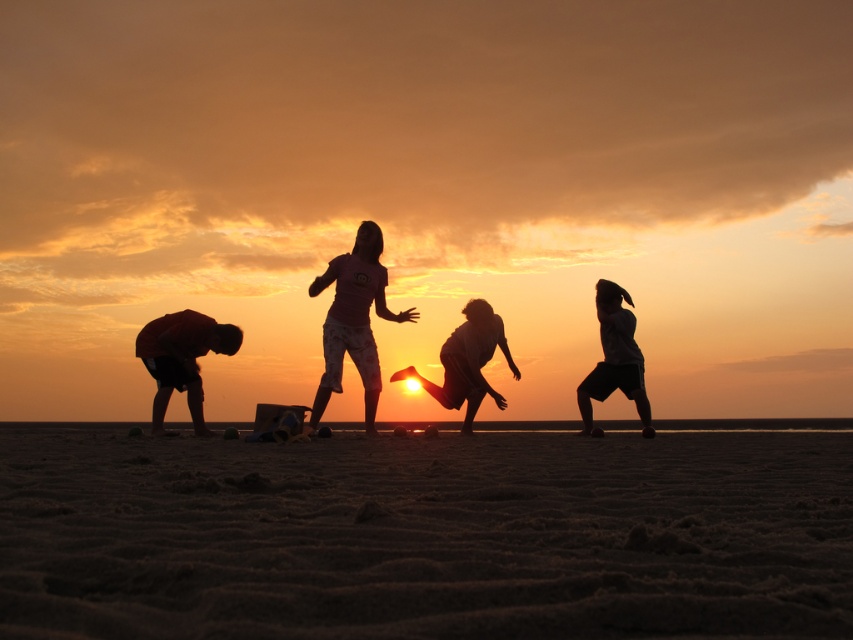
You are standing on the beach and see the pink fabric shorts at center. If you want to take a photo of them with your phone, which has a maximum zoom range of 30 feet, will you be able to get a clear closeup without moving closer?

The pink fabric shorts at center are 34.67 feet away from you. Since your phone has a maximum zoom range of 30 feet, you will not be able to get a clear closeup without moving closer.

You are planning to set up a small tent on the brown sandy beach at lower center. The tent requires a clear space of 20 feet in front of it to avoid the pink fabric shorts at center. Is the current distance sufficient?

The distance between the brown sandy beach at lower center and the pink fabric shorts at center is 18.93 feet, which is less than the required 20 feet. Therefore, the current distance is insufficient to safely set up the tent with the required clear space.